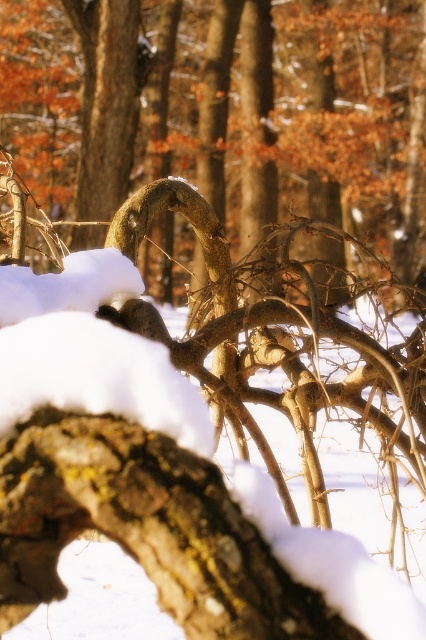
Does point (5, 17) lie behind point (86, 24)?

Yes.

From the picture: Can you confirm if smooth bark tree trunk at center is wider than brown rough tree trunk at upper center?

Yes.

Is point (155, 257) farther from camera compared to point (106, 150)?

That is True.

Locate an element on the screen. smooth bark tree trunk at center is located at coordinates point(350,122).